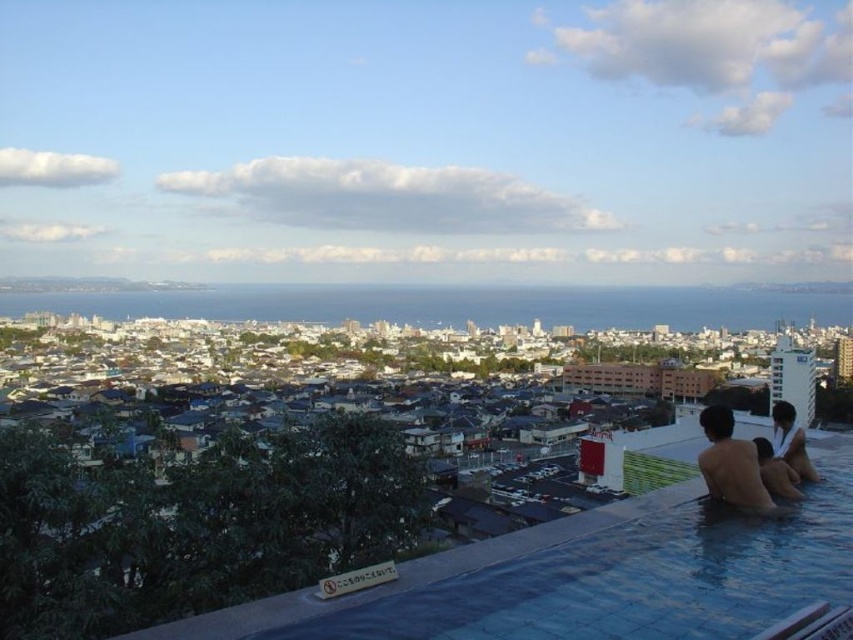
In the scene shown: Can you confirm if skinny man at lower right is bigger than smooth skin man at lower right?

Actually, skinny man at lower right might be smaller than smooth skin man at lower right.

Is skinny man at lower right above smooth skin man at lower right?

Incorrect, skinny man at lower right is not positioned above smooth skin man at lower right.

Is point (706, 433) positioned in front of point (802, 477)?

That is False.

Find the location of a particular element. skinny man at lower right is located at coordinates coord(730,464).